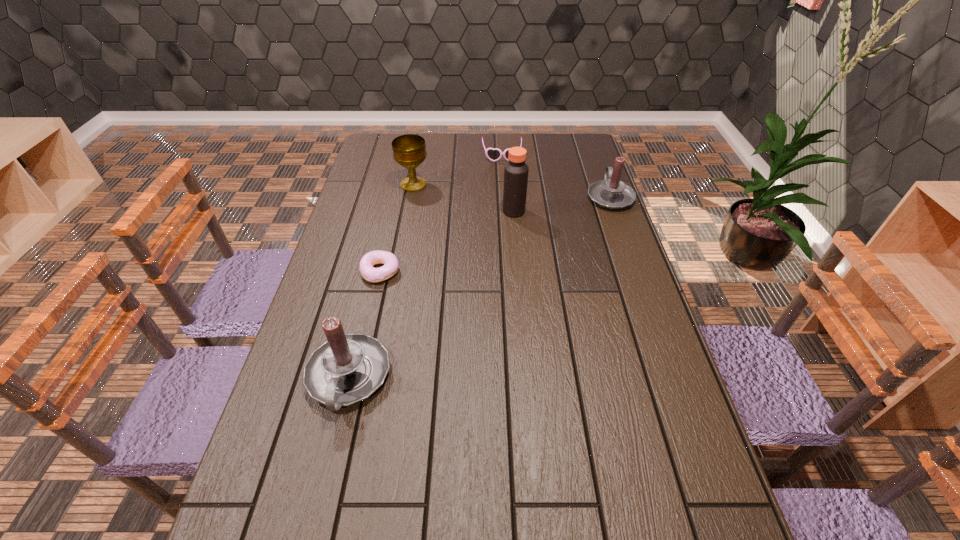
In order to click on vacant region between the chalice and the fifth farthest object in this screenshot , I will do `click(396, 228)`.

Where is `free space between the rightmost object and the nearest object`? This screenshot has width=960, height=540. free space between the rightmost object and the nearest object is located at coordinates (479, 287).

Find the location of a particular element. Image resolution: width=960 pixels, height=540 pixels. vacant space that's between the rightmost object and the vinegar is located at coordinates (562, 204).

Image resolution: width=960 pixels, height=540 pixels. What are the coordinates of `free space between the chalice and the fifth tallest object` in the screenshot? It's located at (458, 170).

Image resolution: width=960 pixels, height=540 pixels. In order to click on free area in between the shorter candle and the farthest object in this screenshot , I will do `click(556, 177)`.

This screenshot has width=960, height=540. What are the coordinates of `free area in between the fifth farthest object and the taller candle` in the screenshot? It's located at (364, 325).

The height and width of the screenshot is (540, 960). Find the location of `free area in between the second shortest object and the chalice`. free area in between the second shortest object and the chalice is located at coordinates (458, 170).

At what (x,y) coordinates should I click in order to perform the action: click on unoccupied area between the left candle and the fifth farthest object. Please return your answer as a coordinate pair (x, y). This screenshot has width=960, height=540. Looking at the image, I should click on (364, 325).

Find the location of a particular element. Image resolution: width=960 pixels, height=540 pixels. object that is the third closest to the right candle is located at coordinates (409, 150).

Locate an element on the screen. Image resolution: width=960 pixels, height=540 pixels. object that is the fifth closest to the fifth tallest object is located at coordinates (348, 368).